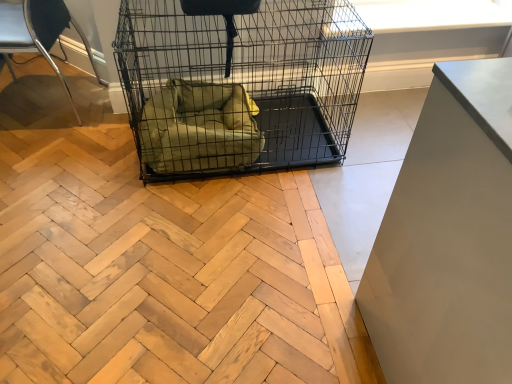
Question: From a real-world perspective, is green fabric dog bed at center positioned above or below black wire mesh cage at center?

Choices:
 (A) above
 (B) below

Answer: (B)

Question: Choose the correct answer: Is green fabric dog bed at center inside black wire mesh cage at center or outside it?

Choices:
 (A) outside
 (B) inside

Answer: (B)

Question: Which object is the closest to the green fabric dog bed at center?

Choices:
 (A) black wire mesh cage at center
 (B) metallic silver chair at left
 (C) white matte cabinet at right

Answer: (A)

Question: Based on their relative distances, which object is farther from the green fabric dog bed at center?

Choices:
 (A) black wire mesh cage at center
 (B) white matte cabinet at right
 (C) metallic silver chair at left

Answer: (C)